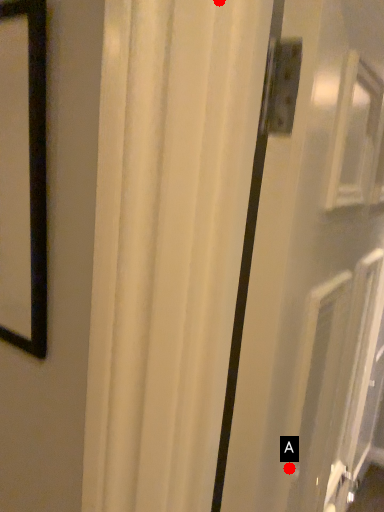
Question: Two points are circled on the image, labeled by A and B beside each circle. Which point is farther to the camera?

Choices:
 (A) A is further
 (B) B is further

Answer: (A)